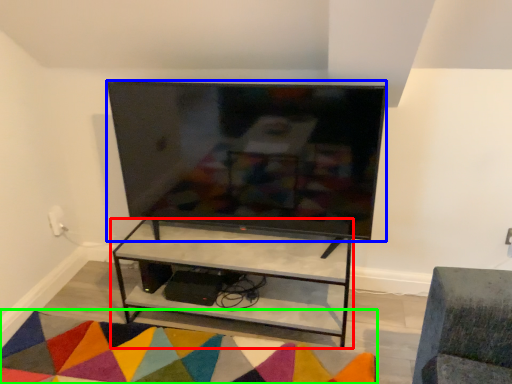
Question: Which object is the closest to the shelf (highlighted by a red box)? Choose among these: television (highlighted by a blue box) or mat (highlighted by a green box).

Choices:
 (A) television
 (B) mat

Answer: (B)